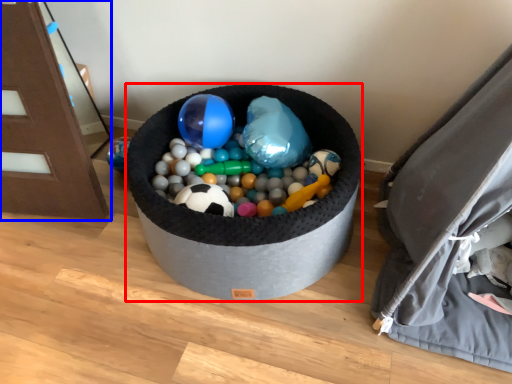
Question: Which object is closer to the camera taking this photo, toy (highlighted by a red box) or furniture (highlighted by a blue box)?

Choices:
 (A) toy
 (B) furniture

Answer: (B)